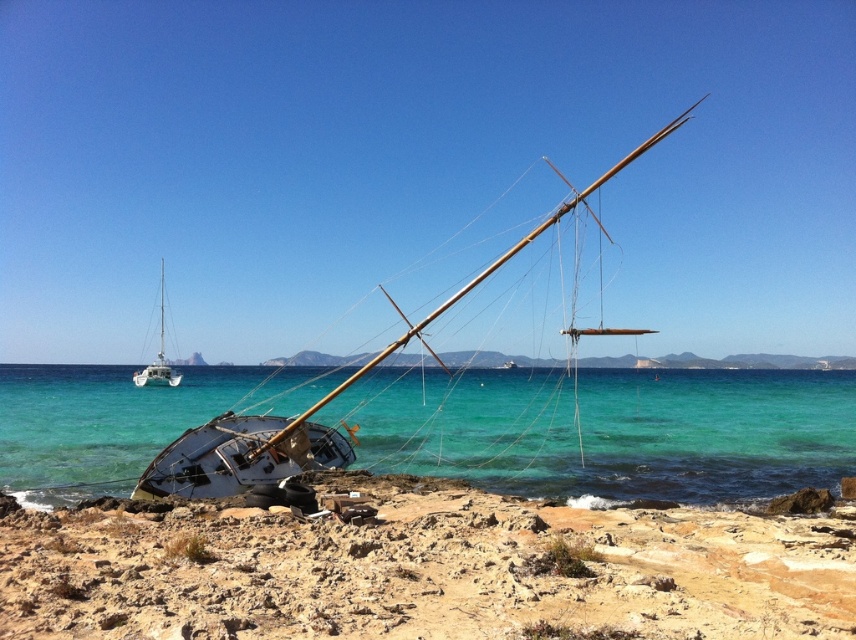
Can you confirm if white wooden sailboat at center is thinner than white matte sailboat at left?

No, white wooden sailboat at center is not thinner than white matte sailboat at left.

Who is more distant from viewer, [183,436] or [163,305]?

The point [163,305] is more distant.

What do you see at coordinates (305, 410) in the screenshot? I see `white wooden sailboat at center` at bounding box center [305, 410].

Identify the location of white wooden sailboat at center. Image resolution: width=856 pixels, height=640 pixels. (305, 410).

Is point (192, 600) positioned in front of point (146, 374)?

That is True.

Is point (146, 513) positioned behind point (159, 310)?

No, (146, 513) is in front of (159, 310).

This screenshot has height=640, width=856. What do you see at coordinates (424, 570) in the screenshot?
I see `rusty metal boat at lower left` at bounding box center [424, 570].

Image resolution: width=856 pixels, height=640 pixels. I want to click on rusty metal boat at lower left, so (x=424, y=570).

Who is lower down, rusty metal boat at lower left or white wooden sailboat at center?

rusty metal boat at lower left is lower down.

Is rusty metal boat at lower left shorter than white wooden sailboat at center?

Yes.

Does point (406, 572) lie in front of point (245, 452)?

Yes.

Locate an element on the screen. rusty metal boat at lower left is located at coordinates (424, 570).